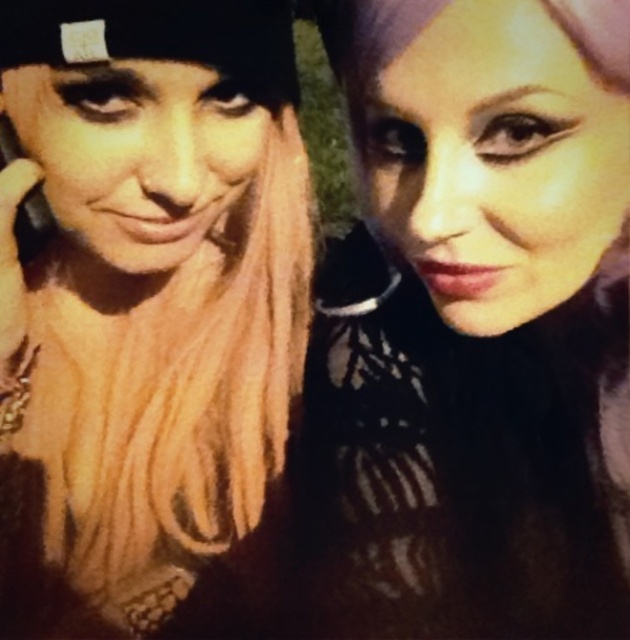
Is matte black hair at center smaller than matte black beanie at upper left?

Incorrect, matte black hair at center is not smaller in size than matte black beanie at upper left.

Does matte black hair at center have a greater height compared to matte black beanie at upper left?

In fact, matte black hair at center may be shorter than matte black beanie at upper left.

Does point (590, 362) lie behind point (261, 540)?

No, it is not.

Image resolution: width=630 pixels, height=640 pixels. Find the location of `matte black hair at center`. matte black hair at center is located at coordinates coord(472,326).